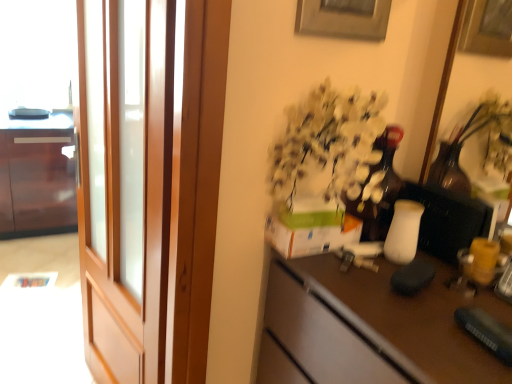
Question: Does brown matte desk at center have a lesser width compared to wooden screen door at left?

Choices:
 (A) yes
 (B) no

Answer: (B)

Question: Does brown matte desk at center lie behind wooden screen door at left?

Choices:
 (A) yes
 (B) no

Answer: (B)

Question: Considering the relative positions of brown matte desk at center and wooden screen door at left in the image provided, is brown matte desk at center to the left of wooden screen door at left from the viewer's perspective?

Choices:
 (A) yes
 (B) no

Answer: (B)

Question: Can you confirm if brown matte desk at center is bigger than wooden screen door at left?

Choices:
 (A) yes
 (B) no

Answer: (A)

Question: Considering the relative sizes of brown matte desk at center and wooden screen door at left in the image provided, is brown matte desk at center smaller than wooden screen door at left?

Choices:
 (A) yes
 (B) no

Answer: (B)

Question: Considering the relative positions of brown matte desk at center and wooden screen door at left in the image provided, is brown matte desk at center to the right of wooden screen door at left from the viewer's perspective?

Choices:
 (A) yes
 (B) no

Answer: (A)

Question: Is wooden screen door at left not close to brown matte desk at center?

Choices:
 (A) yes
 (B) no

Answer: (B)

Question: Can you confirm if wooden screen door at left is smaller than brown matte desk at center?

Choices:
 (A) no
 (B) yes

Answer: (B)

Question: Is wooden screen door at left thinner than brown matte desk at center?

Choices:
 (A) no
 (B) yes

Answer: (B)

Question: Is wooden screen door at left completely or partially outside of brown matte desk at center?

Choices:
 (A) yes
 (B) no

Answer: (A)

Question: Does wooden screen door at left turn towards brown matte desk at center?

Choices:
 (A) yes
 (B) no

Answer: (B)

Question: Does wooden screen door at left contain brown matte desk at center?

Choices:
 (A) yes
 (B) no

Answer: (B)

Question: Can brown matte desk at center be found inside glossy wood cabinet at left?

Choices:
 (A) no
 (B) yes

Answer: (A)